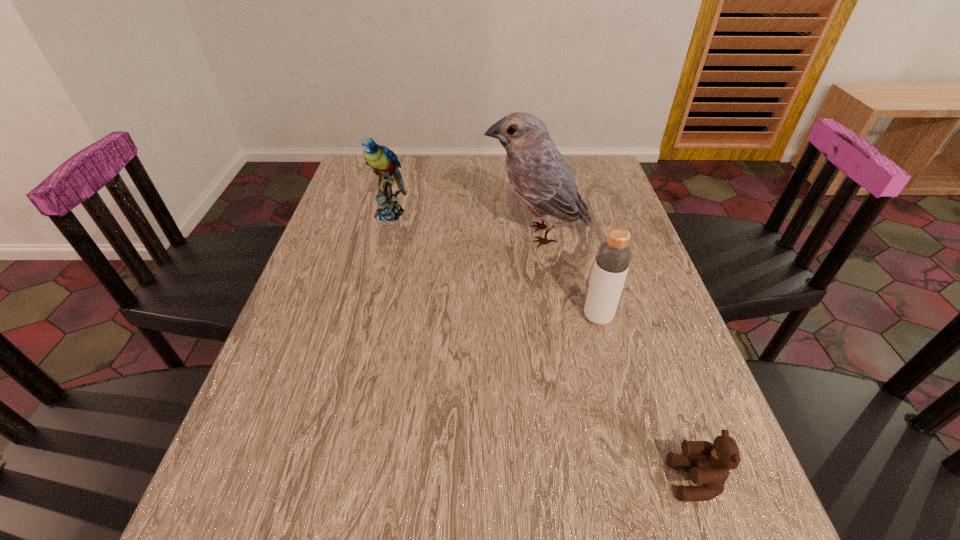
In order to click on free space between the rightmost object and the tallest object in this screenshot , I will do `click(616, 357)`.

Find the location of a particular element. This screenshot has height=540, width=960. free space between the shortest object and the right parrot is located at coordinates (616, 357).

Where is `blank region between the teddy bear and the third farthest object`? The image size is (960, 540). blank region between the teddy bear and the third farthest object is located at coordinates (646, 399).

I want to click on empty space that is in between the taller parrot and the teddy bear, so click(x=616, y=357).

Identify which object is the third closest to the shortest object. Please provide its 2D coordinates. Your answer should be formatted as a tuple, i.e. [(x, y)], where the tuple contains the x and y coordinates of a point satisfying the conditions above.

[(383, 161)]

Locate an element on the screen. This screenshot has width=960, height=540. object that stands as the closest to the right parrot is located at coordinates (613, 257).

Where is `free spot that satisfies the following two spatial constraints: 1. on the front-facing side of the second nearest object; 2. on the left side of the right parrot`? This screenshot has height=540, width=960. free spot that satisfies the following two spatial constraints: 1. on the front-facing side of the second nearest object; 2. on the left side of the right parrot is located at coordinates (550, 317).

Find the location of `free location that satisfies the following two spatial constraints: 1. on the front-facing side of the taller parrot; 2. on the back side of the second nearest object`. free location that satisfies the following two spatial constraints: 1. on the front-facing side of the taller parrot; 2. on the back side of the second nearest object is located at coordinates (550, 317).

Identify the location of vacant space that satisfies the following two spatial constraints: 1. on the face of the bottle; 2. on the right side of the left parrot. (363, 317).

Find the location of `vacant space that satisfies the following two spatial constraints: 1. on the front-facing side of the tallest object; 2. on the left side of the bottle`. vacant space that satisfies the following two spatial constraints: 1. on the front-facing side of the tallest object; 2. on the left side of the bottle is located at coordinates (550, 317).